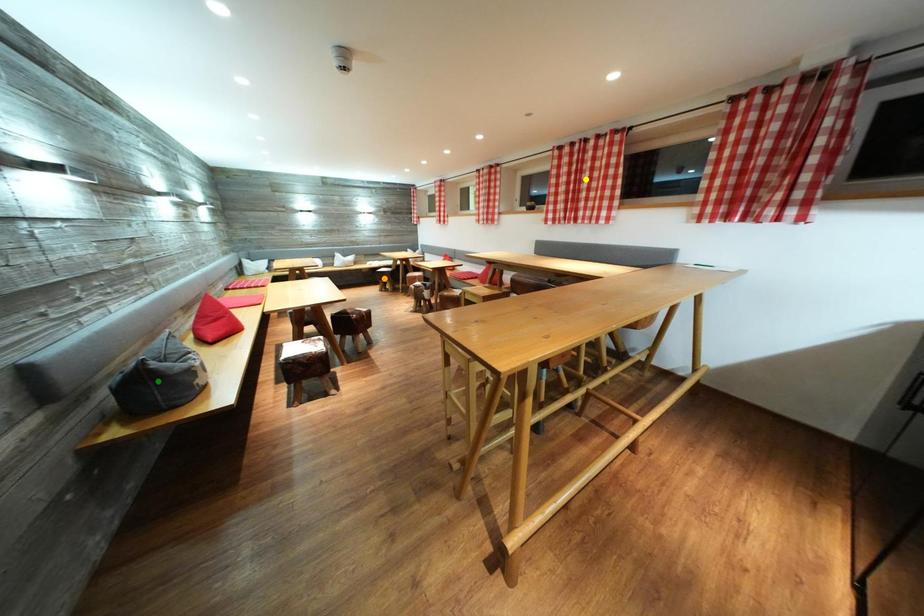
Order these from nearest to farthest:
orange point, yellow point, green point

green point → yellow point → orange point